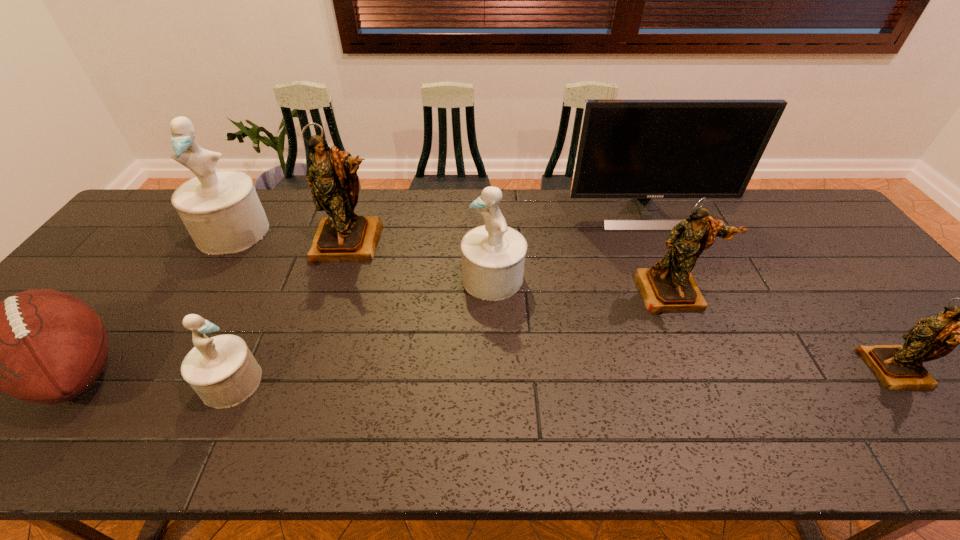
You are a GUI agent. You are given a task and a screenshot of the screen. Output one action in this format:
    pyautogui.click(x=<x>, y=<y>)
    Task: Click on the vacant space located 0.170m on the front-facing side of the rightmost figurine
    
    Given the screenshot: What is the action you would take?
    pyautogui.click(x=794, y=370)

Where is `vacant space located 0.320m on the front-facing side of the rightmost figurine`? This screenshot has height=540, width=960. vacant space located 0.320m on the front-facing side of the rightmost figurine is located at coordinates (729, 370).

Identify the location of free space located on the front-facing side of the rightmost figurine. This screenshot has width=960, height=540. (737, 370).

You are a GUI agent. You are given a task and a screenshot of the screen. Output one action in this format:
    pyautogui.click(x=<x>, y=<y>)
    Task: Click on the free space located 0.090m at the beak of the second white figurine from left to right
    This screenshot has width=960, height=540.
    Given the screenshot: What is the action you would take?
    pyautogui.click(x=300, y=382)

You are a GUI agent. You are given a task and a screenshot of the screen. Output one action in this format:
    pyautogui.click(x=<x>, y=<y>)
    Task: Click on the monitor present at the far edge
    This screenshot has height=540, width=960.
    Given the screenshot: What is the action you would take?
    pyautogui.click(x=642, y=149)

Where is `object at the right edge`? Image resolution: width=960 pixels, height=540 pixels. object at the right edge is located at coordinates (898, 367).

Where is `free space at the near edge`? free space at the near edge is located at coordinates (81, 436).

The width and height of the screenshot is (960, 540). I want to click on free space at the left edge, so click(144, 262).

Where is `vacant point at the right edge`? This screenshot has width=960, height=540. vacant point at the right edge is located at coordinates (821, 247).

The height and width of the screenshot is (540, 960). Find the location of `free point at the far left corner`. free point at the far left corner is located at coordinates (151, 224).